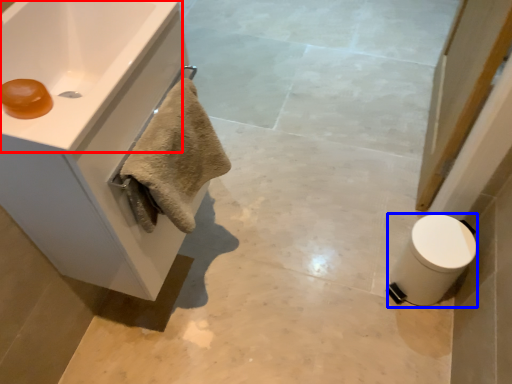
Question: Which object is closer to the camera taking this photo, sink (highlighted by a red box) or toilet bowl (highlighted by a blue box)?

Choices:
 (A) sink
 (B) toilet bowl

Answer: (A)